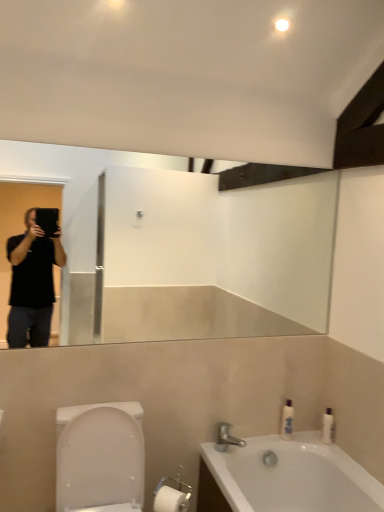
Question: Can you confirm if silver metallic faucet at lower center is bigger than white glossy bottle at right, arranged as the second toiletry when viewed from the left?

Choices:
 (A) yes
 (B) no

Answer: (A)

Question: From a real-world perspective, is silver metallic faucet at lower center located beneath white glossy bottle at right, the 1th toiletry when ordered from right to left?

Choices:
 (A) yes
 (B) no

Answer: (A)

Question: Is silver metallic faucet at lower center at the left side of white glossy bottle at right, the 1th toiletry when ordered from right to left?

Choices:
 (A) no
 (B) yes

Answer: (B)

Question: Is silver metallic faucet at lower center in front of white glossy bottle at right, arranged as the second toiletry when viewed from the left?

Choices:
 (A) no
 (B) yes

Answer: (B)

Question: From the image's perspective, is silver metallic faucet at lower center located above white glossy bottle at right, the 1th toiletry when ordered from right to left?

Choices:
 (A) no
 (B) yes

Answer: (A)

Question: Is silver metallic faucet at lower center outside of white glossy bottle at right, the 1th toiletry when ordered from right to left?

Choices:
 (A) yes
 (B) no

Answer: (A)

Question: Is silver metallic faucet at lower center aimed at white glossy bottle at right, arranged as the 2th toiletry when viewed from the right?

Choices:
 (A) yes
 (B) no

Answer: (B)

Question: Is silver metallic faucet at lower center taller than white glossy bottle at right, arranged as the 2th toiletry when viewed from the right?

Choices:
 (A) no
 (B) yes

Answer: (A)

Question: Is white glossy bottle at right, which is counted as the first toiletry, starting from the left, at the back of silver metallic faucet at lower center?

Choices:
 (A) no
 (B) yes

Answer: (A)

Question: Can you confirm if silver metallic faucet at lower center is bigger than white glossy bottle at right, which is counted as the first toiletry, starting from the left?

Choices:
 (A) yes
 (B) no

Answer: (A)

Question: From the image's perspective, is silver metallic faucet at lower center located beneath white glossy bottle at right, which is counted as the first toiletry, starting from the left?

Choices:
 (A) no
 (B) yes

Answer: (B)

Question: Considering the relative sizes of silver metallic faucet at lower center and white glossy bottle at right, arranged as the 2th toiletry when viewed from the right, in the image provided, is silver metallic faucet at lower center shorter than white glossy bottle at right, arranged as the 2th toiletry when viewed from the right,?

Choices:
 (A) no
 (B) yes

Answer: (B)

Question: Does white glossy bathtub at lower right come in front of silver metallic faucet at lower center?

Choices:
 (A) yes
 (B) no

Answer: (A)